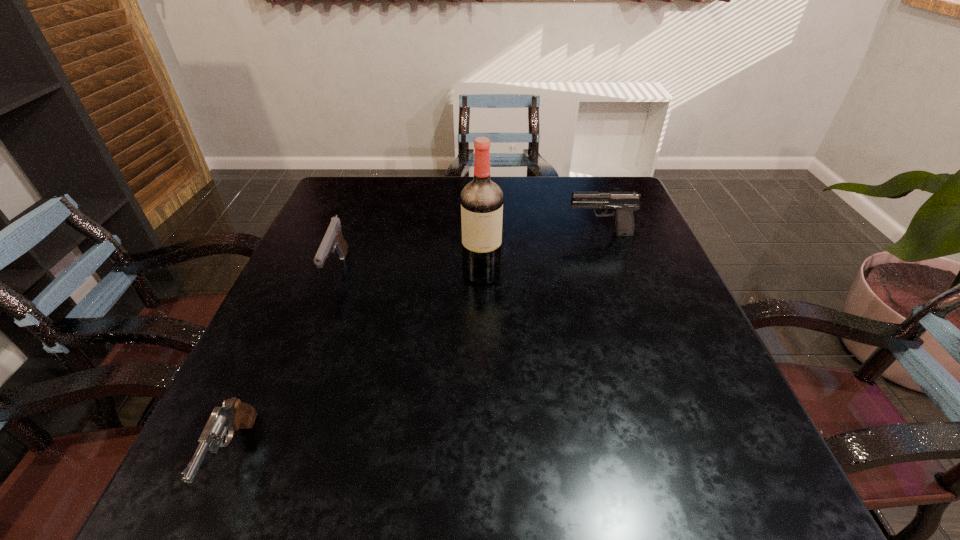
Select which object appears as the second closest to the second object from right to left. Please provide its 2D coordinates. Your answer should be formatted as a tuple, i.e. [(x, y)], where the tuple contains the x and y coordinates of a point satisfying the conditions above.

[(333, 237)]

Select which pistol appears as the third closest to the tallest object. Please provide its 2D coordinates. Your answer should be formatted as a tuple, i.e. [(x, y)], where the tuple contains the x and y coordinates of a point satisfying the conditions above.

[(233, 415)]

Locate an element on the screen. This screenshot has height=540, width=960. pistol that stands as the second closest to the nearest pistol is located at coordinates (624, 203).

Where is `vacant position in the image that satisfies the following two spatial constraints: 1. aim along the barrel of the rightmost pistol; 2. at the barrel of the nearest object`? The image size is (960, 540). vacant position in the image that satisfies the following two spatial constraints: 1. aim along the barrel of the rightmost pistol; 2. at the barrel of the nearest object is located at coordinates (678, 456).

This screenshot has height=540, width=960. I want to click on free location that satisfies the following two spatial constraints: 1. aim along the barrel of the rightmost pistol; 2. at the barrel of the second pistol from right to left, so click(x=612, y=271).

This screenshot has width=960, height=540. Identify the location of free space that satisfies the following two spatial constraints: 1. aim along the barrel of the rightmost object; 2. at the barrel of the second pistol from left to right. click(612, 271).

I want to click on blank space that satisfies the following two spatial constraints: 1. aim along the barrel of the farthest pistol; 2. on the front-facing side of the tallest object, so click(613, 273).

Find the location of a particular element. The image size is (960, 540). free space that satisfies the following two spatial constraints: 1. aim along the barrel of the rightmost object; 2. at the barrel of the nearest pistol is located at coordinates (678, 456).

At what (x,y) coordinates should I click in order to perform the action: click on free point that satisfies the following two spatial constraints: 1. aim along the barrel of the rightmost object; 2. on the front-facing side of the tallest object. Please return your answer as a coordinate pair (x, y). Looking at the image, I should click on (613, 273).